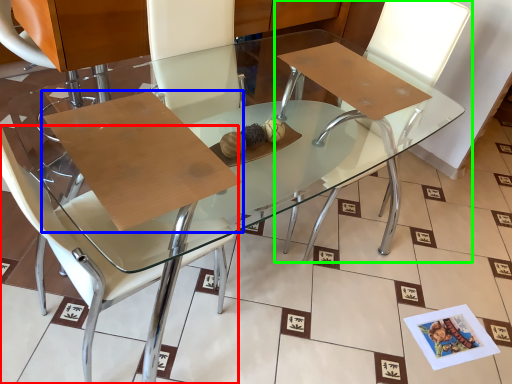
Question: Considering the real-world distances, which object is farthest from chair (highlighted by a red box)? cardboard (highlighted by a blue box) or chair (highlighted by a green box)?

Choices:
 (A) cardboard
 (B) chair

Answer: (B)